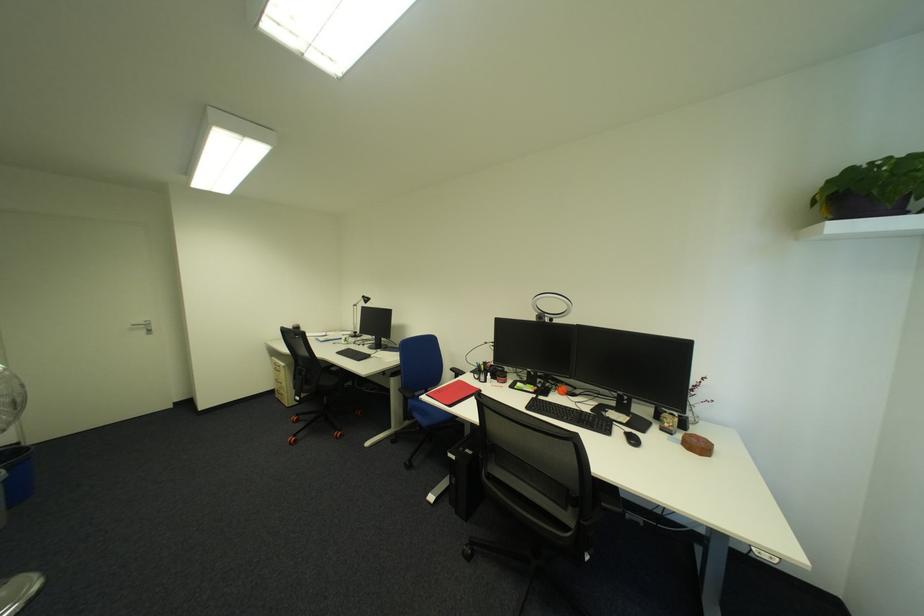
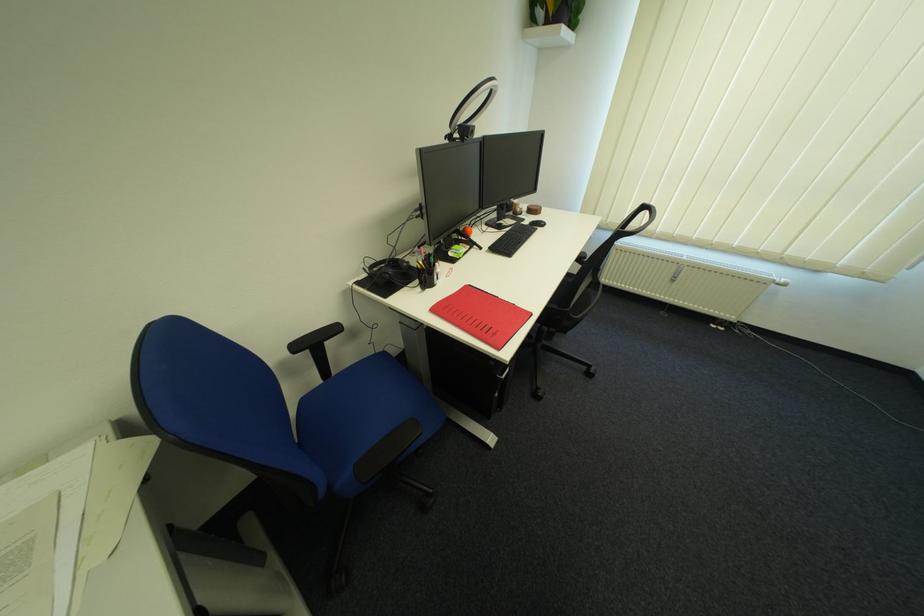
The point at (462, 370) is marked in the first image. Where is the corresponding point in the second image?

(306, 349)